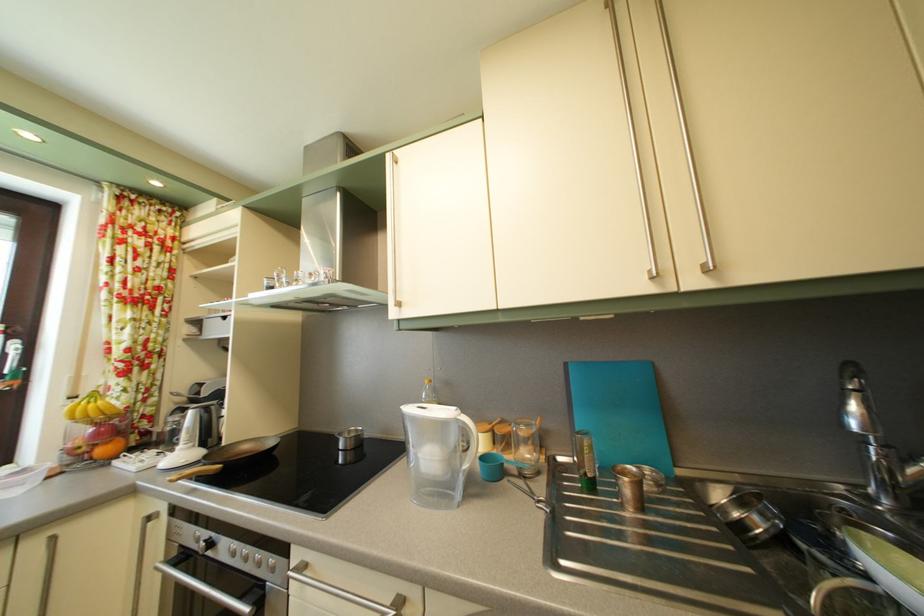
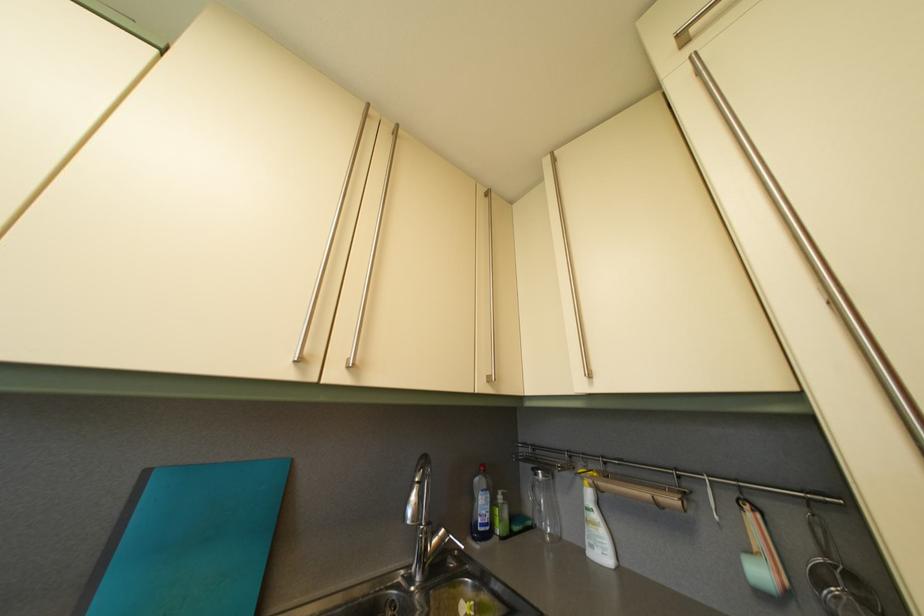
Locate, in the second image, the point that corresponds to the point at 699,264 in the first image.

(350, 355)